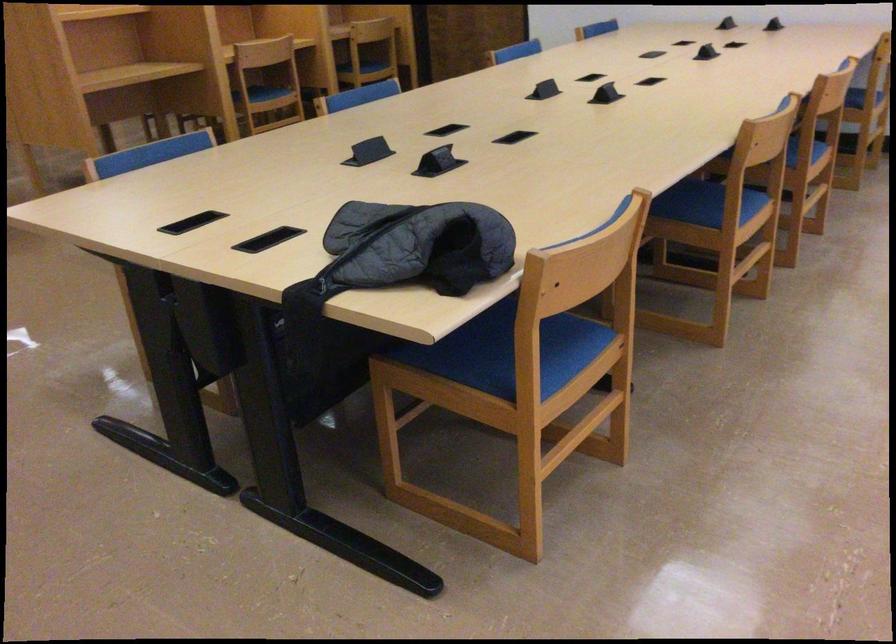
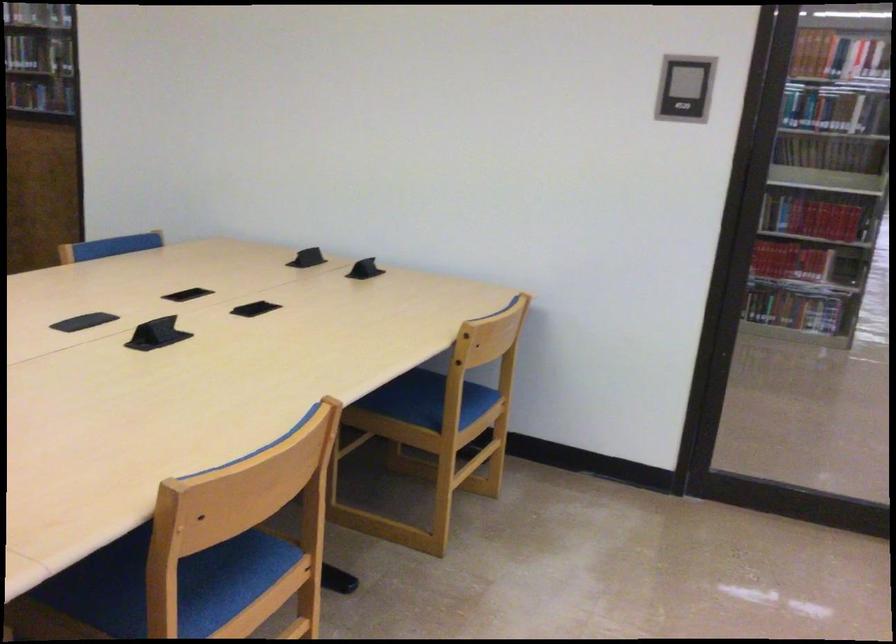
In a continuous first-person perspective shot, in which direction is the camera moving?

The cameraman moved toward right, forward.